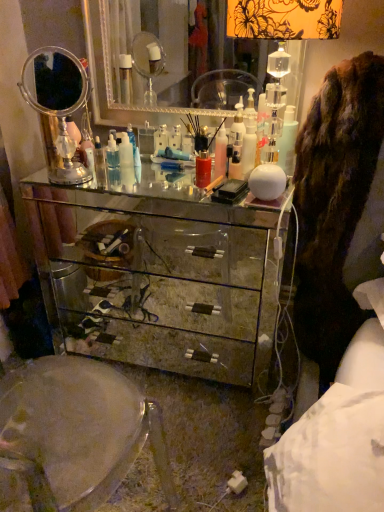
The width and height of the screenshot is (384, 512). In order to click on blank area to the left of translucent plastic bottle at center, the 2th toiletry when ordered from left to right in this screenshot , I will do `click(203, 168)`.